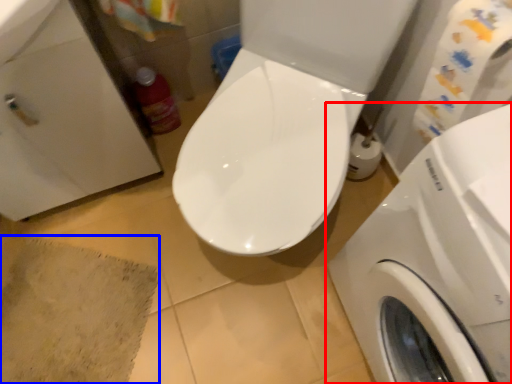
Question: Which of the following is the farthest to the observer, washing machine (highlighted by a red box) or bath mat (highlighted by a blue box)?

Choices:
 (A) washing machine
 (B) bath mat

Answer: (B)